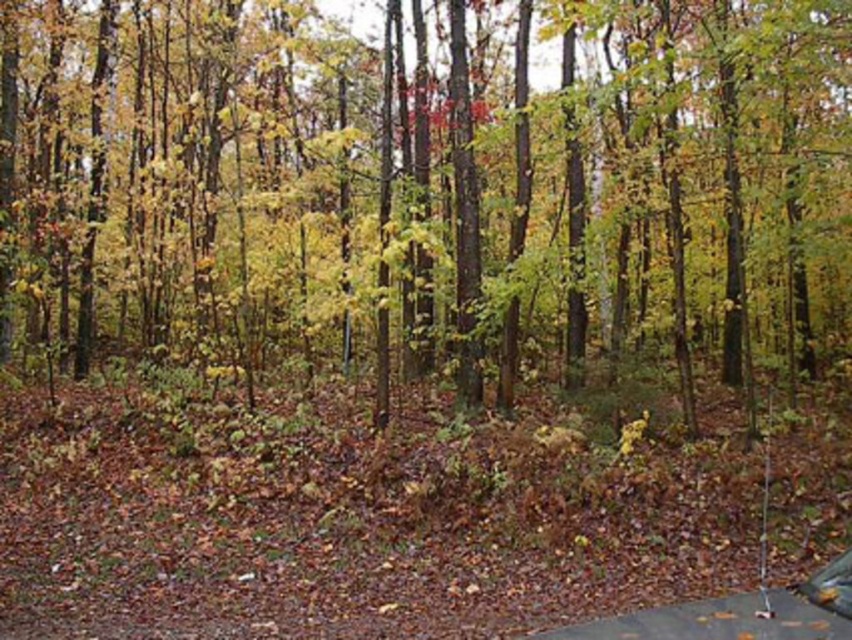
You are standing in the forest and see two points marked in the image. The first point is at coordinates point (326, 353) and the second is at point (839, 593). Which point is closer to you?

Point (839, 593) is closer to you because it is in front of point (326, 353).